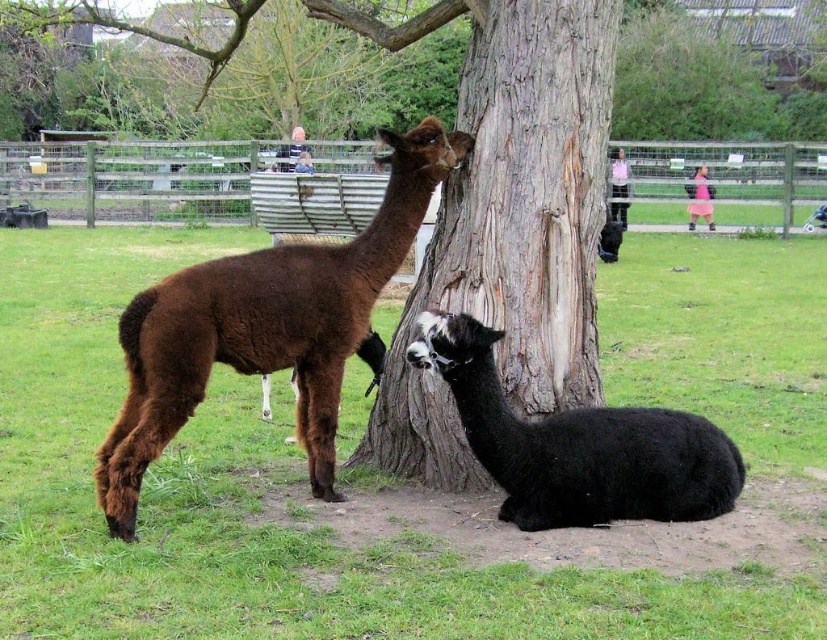
Question: Is brown rough bark at center bigger than pink fabric dress at center?

Choices:
 (A) no
 (B) yes

Answer: (B)

Question: Where is brown rough bark at center located in relation to black woolly alpaca at lower center in the image?

Choices:
 (A) right
 (B) left

Answer: (B)

Question: Which object is the farthest from the black woolly alpaca at lower center?

Choices:
 (A) pink fabric skirt at upper right
 (B) brown rough bark at center

Answer: (A)

Question: Estimate the real-world distances between objects in this image. Which object is closer to the brown woolly alpaca at left?

Choices:
 (A) pink fabric skirt at upper right
 (B) brown rough bark at center

Answer: (B)

Question: Which is nearer to the brown rough bark at center?

Choices:
 (A) pink fabric dress at center
 (B) brown woolly alpaca at left
 (C) black woolly alpaca at lower center
 (D) pink fabric skirt at upper right

Answer: (B)

Question: Is pink fabric dress at center positioned before pink fabric skirt at upper right?

Choices:
 (A) no
 (B) yes

Answer: (B)